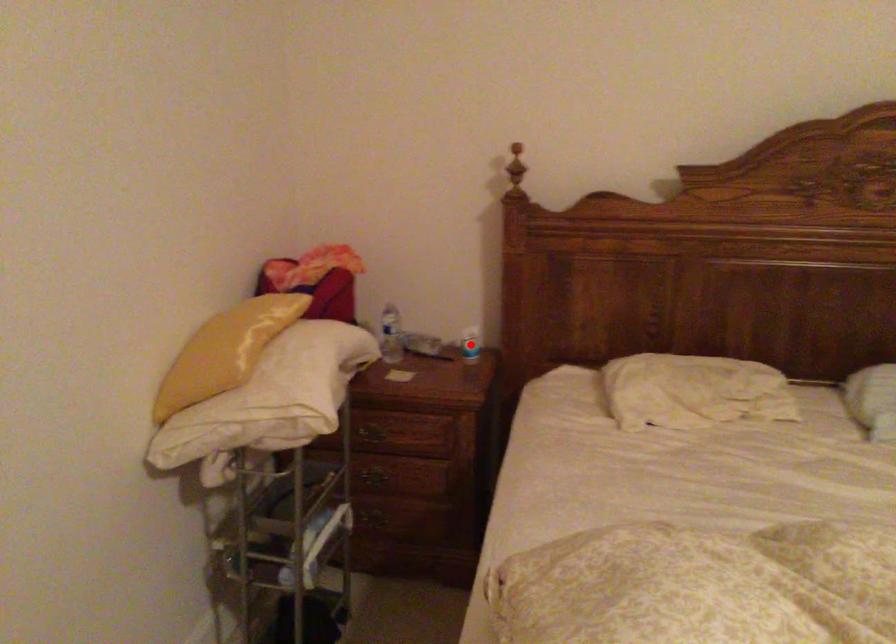
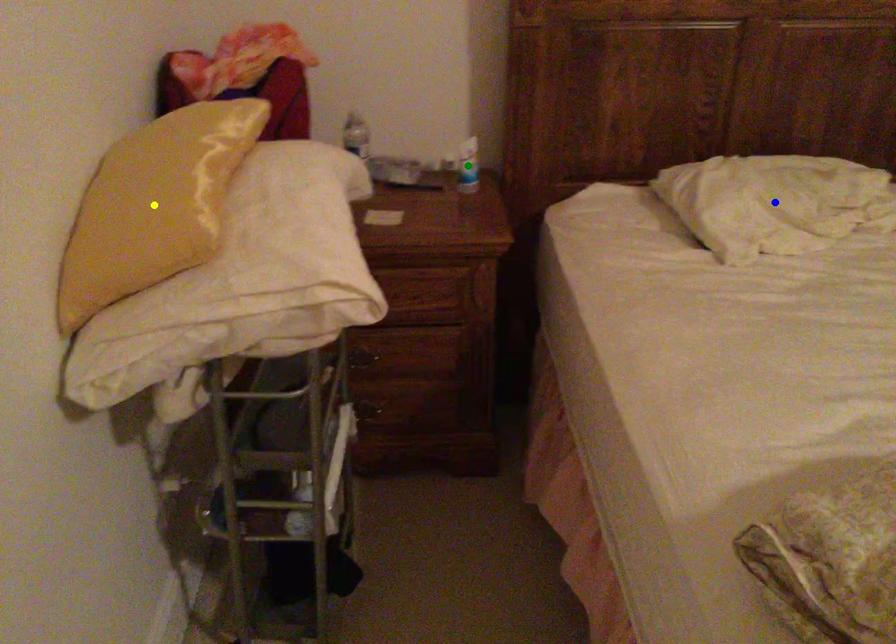
Question: I am providing you with two images of the same scene from different viewpoints. A red point is marked on the first image. You are given multiple points on the second image. Which point in image 2 represents the same 3d spot as the red point in image 1?

Choices:
 (A) yellow point
 (B) green point
 (C) blue point

Answer: (B)